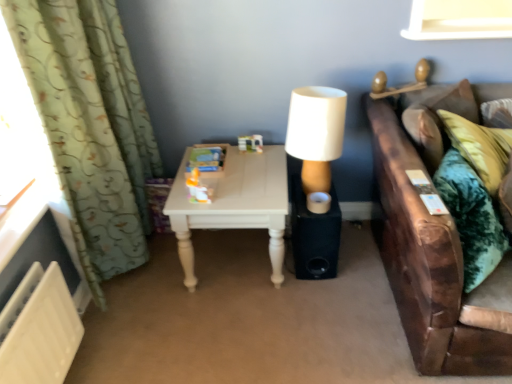
I want to click on free point below white painted wood table at center (from a real-world perspective), so click(x=233, y=264).